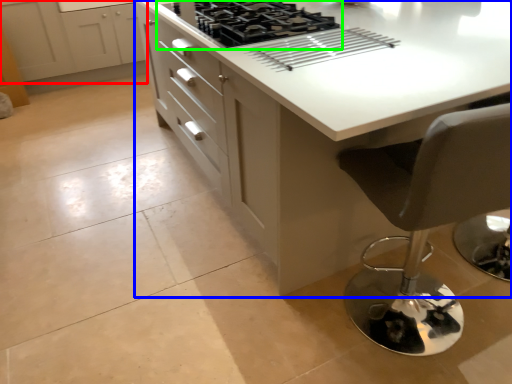
Question: Considering the real-world distances, which object is closest to cabinetry (highlighted by a red box)? countertop (highlighted by a blue box) or gas stove (highlighted by a green box).

Choices:
 (A) countertop
 (B) gas stove

Answer: (B)